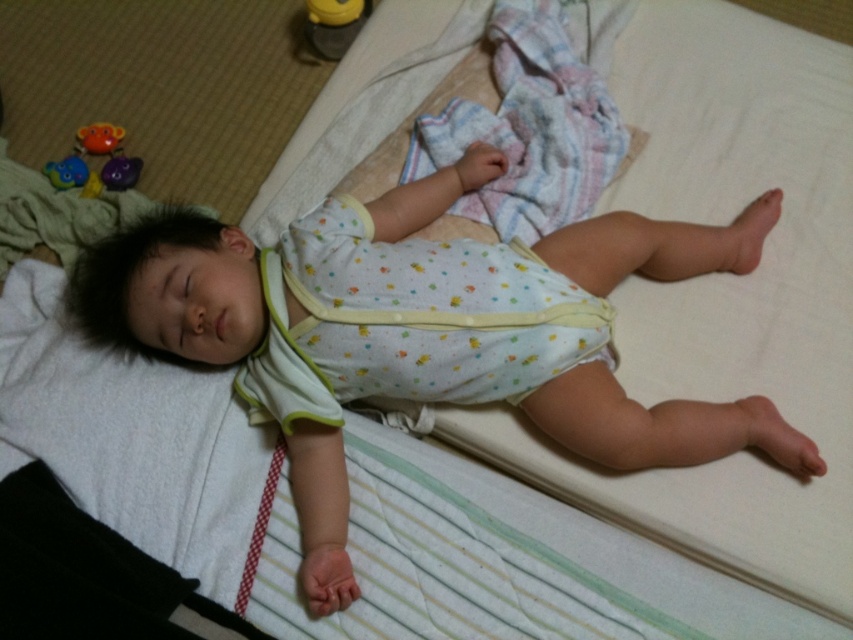
You are a parent checking on your baby. You notice the white dotted fabric diaper at center and the matte plastic toys at upper left. Which object is wider?

The white dotted fabric diaper at center is wider than the matte plastic toys at upper left.

Where is the white dotted fabric diaper at center located in the image?

The white dotted fabric diaper at center is located at point (421, 314) in the image.